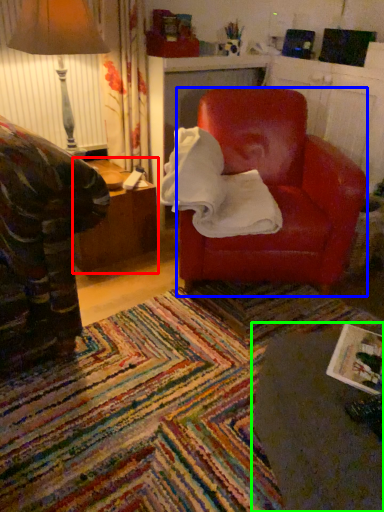
Question: Which object is positioned farthest from table (highlighted by a red box)? Select from chair (highlighted by a blue box) and table (highlighted by a green box).

Choices:
 (A) chair
 (B) table

Answer: (B)